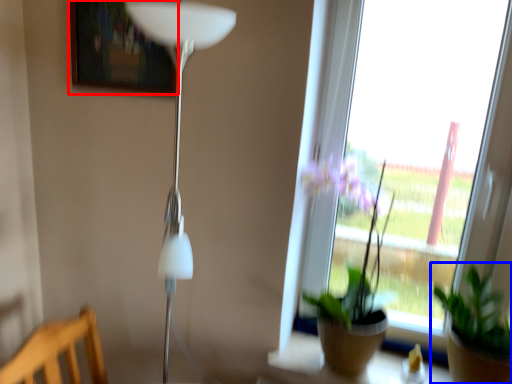
Question: Which object appears closest to the camera in this image, picture frame (highlighted by a red box) or houseplant (highlighted by a blue box)?

Choices:
 (A) picture frame
 (B) houseplant

Answer: (B)